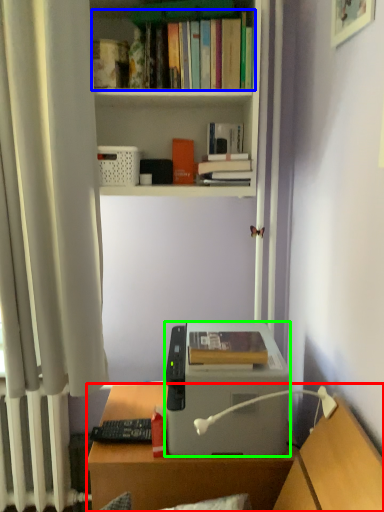
Question: Considering the real-world distances, which object is closest to desk (highlighted by a red box)? book (highlighted by a blue box) or printer (highlighted by a green box).

Choices:
 (A) book
 (B) printer

Answer: (B)